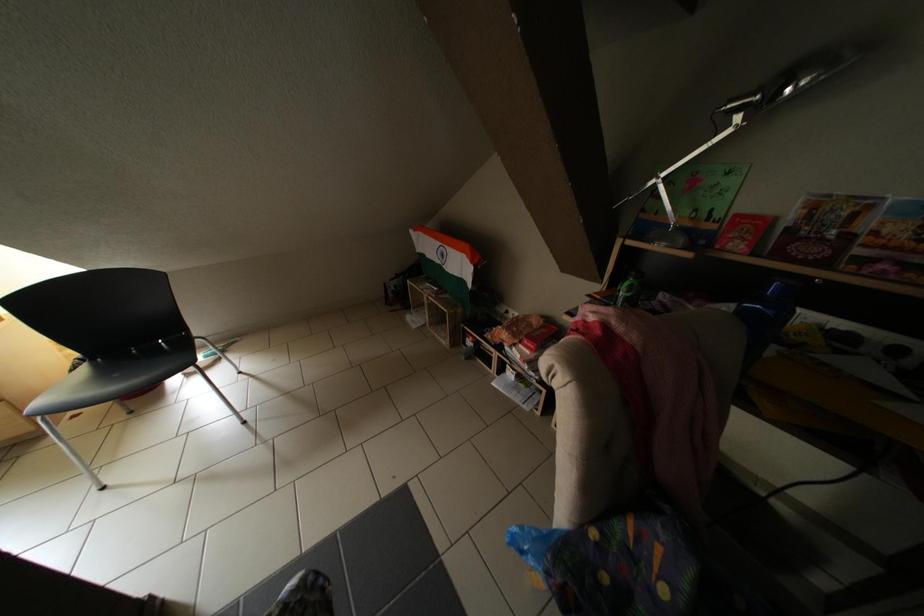
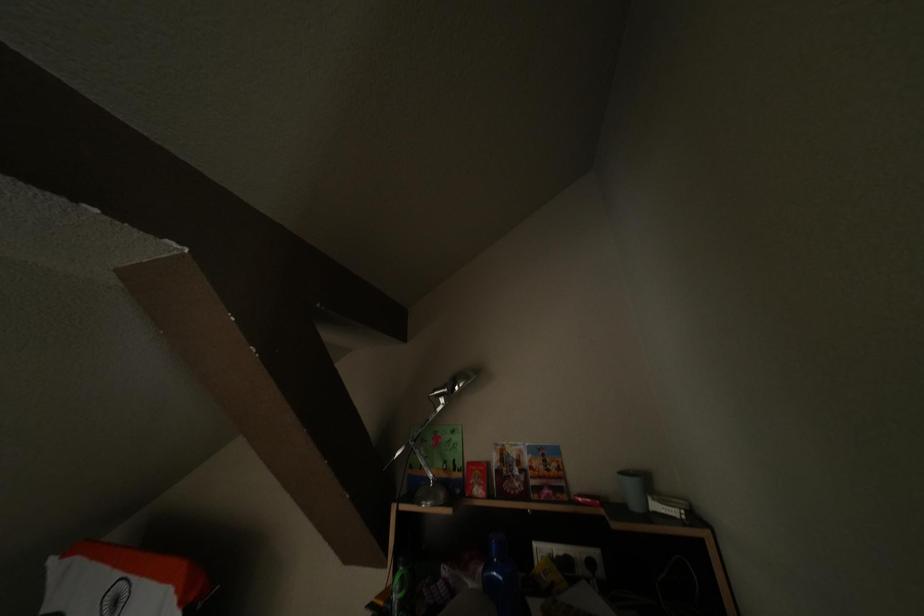
The first image is from the beginning of the video and the second image is from the end. How did the camera likely rotate when shooting the video?

The camera's rotation is toward right-up.